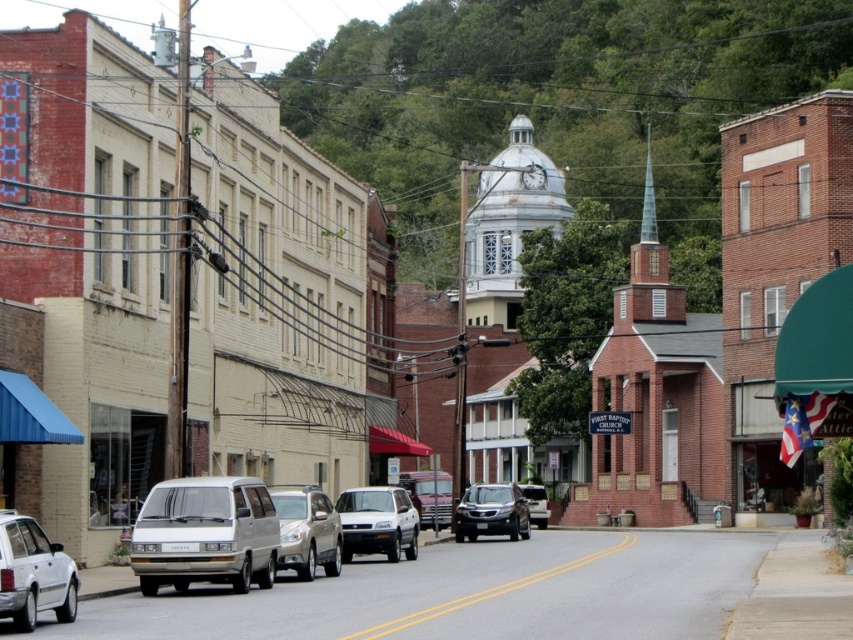
Question: Is white matte suv at center further to the viewer compared to metallic silver suv at center?

Choices:
 (A) no
 (B) yes

Answer: (A)

Question: Which point is farther to the camera?

Choices:
 (A) satin silver suv at center
 (B) metallic silver suv at center
 (C) metallic silver truck at center

Answer: (B)

Question: Among these objects, which one is farthest from the camera?

Choices:
 (A) metallic silver suv at center
 (B) white matte van at center
 (C) satin black suv at center
 (D) white matte van at lower left

Answer: (A)

Question: Does satin black suv at center have a greater width compared to metallic silver truck at center?

Choices:
 (A) no
 (B) yes

Answer: (B)

Question: Which object is farther from the camera taking this photo?

Choices:
 (A) satin black suv at center
 (B) metallic silver truck at center
 (C) white matte van at lower left

Answer: (B)

Question: From the image, what is the correct spatial relationship of white matte van at lower left in relation to metallic silver suv at center?

Choices:
 (A) below
 (B) above

Answer: (B)